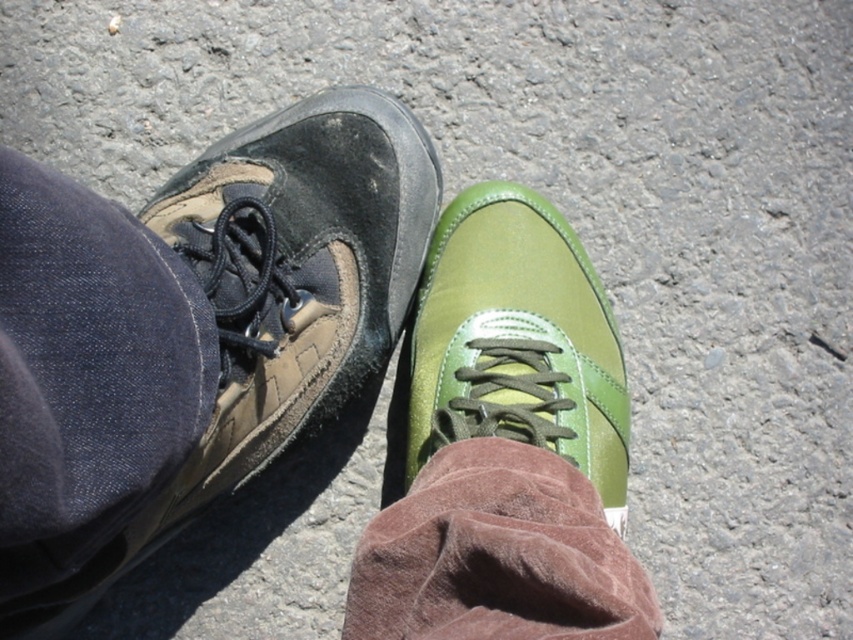
Question: Does green leather shoe at center have a smaller size compared to brown suede sock at lower center?

Choices:
 (A) no
 (B) yes

Answer: (A)

Question: Which of these objects is positioned closest to the brown suede sock at lower center?

Choices:
 (A) green leather shoe at center
 (B) matte brown leather shoe at left

Answer: (A)

Question: Which object appears closest to the camera in this image?

Choices:
 (A) green leather shoe at center
 (B) matte brown leather shoe at left
 (C) brown suede sock at lower center

Answer: (B)

Question: Can you confirm if matte brown leather shoe at left is wider than green leather shoe at center?

Choices:
 (A) yes
 (B) no

Answer: (A)

Question: Does green leather shoe at center appear on the right side of brown suede sock at lower center?

Choices:
 (A) no
 (B) yes

Answer: (B)

Question: Which point is closer to the camera?

Choices:
 (A) (560, 612)
 (B) (514, 380)
 (C) (323, 227)

Answer: (A)